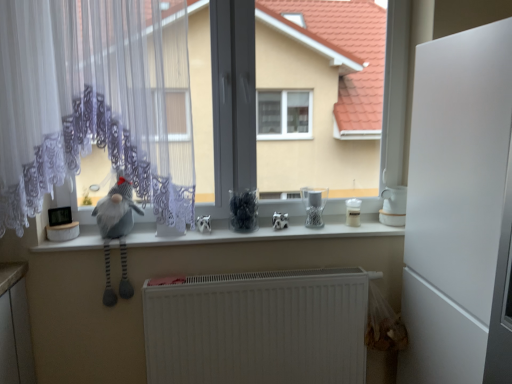
Question: Does white matte radiator at lower center have a larger size compared to white glossy counter top at center?

Choices:
 (A) yes
 (B) no

Answer: (A)

Question: Is white matte radiator at lower center facing towards white glossy counter top at center?

Choices:
 (A) no
 (B) yes

Answer: (A)

Question: Is white glossy counter top at center surrounded by white matte radiator at lower center?

Choices:
 (A) yes
 (B) no

Answer: (B)

Question: Is white matte radiator at lower center behind white glossy counter top at center?

Choices:
 (A) yes
 (B) no

Answer: (B)

Question: Considering the relative positions of white matte radiator at lower center and white glossy counter top at center in the image provided, is white matte radiator at lower center to the left of white glossy counter top at center from the viewer's perspective?

Choices:
 (A) yes
 (B) no

Answer: (B)

Question: Considering the relative positions of white matte radiator at lower center and white glossy counter top at center in the image provided, is white matte radiator at lower center to the right of white glossy counter top at center from the viewer's perspective?

Choices:
 (A) yes
 (B) no

Answer: (A)

Question: Is white matte refrigerator at right aimed at white glossy counter top at center?

Choices:
 (A) no
 (B) yes

Answer: (A)

Question: Is white matte refrigerator at right located outside white glossy counter top at center?

Choices:
 (A) no
 (B) yes

Answer: (B)

Question: Does white matte refrigerator at right have a smaller size compared to white glossy counter top at center?

Choices:
 (A) yes
 (B) no

Answer: (B)

Question: Is white glossy counter top at center at the back of white matte refrigerator at right?

Choices:
 (A) yes
 (B) no

Answer: (B)

Question: From a real-world perspective, is white matte refrigerator at right under white glossy counter top at center?

Choices:
 (A) no
 (B) yes

Answer: (A)

Question: Does white matte refrigerator at right appear on the left side of white glossy counter top at center?

Choices:
 (A) no
 (B) yes

Answer: (A)

Question: From a real-world perspective, is white lace curtain at left on clear glass jar at center, marked as the first appliance in a left-to-right arrangement?

Choices:
 (A) yes
 (B) no

Answer: (A)